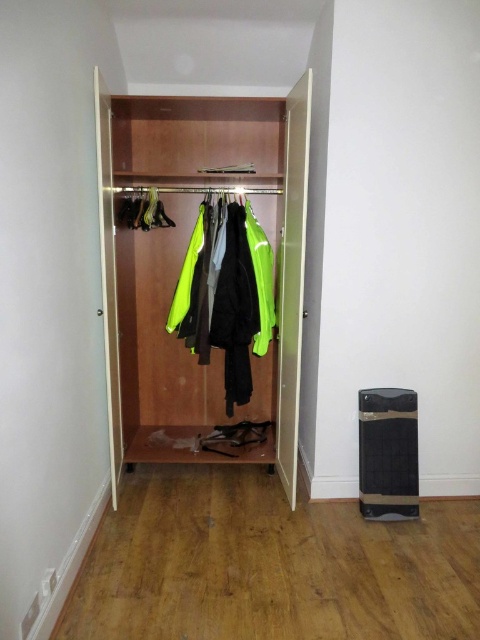
You are organizing your closet and need to place a neon yellow fabric at center. Where should you place it relative to the wooden coat rack at center?

The neon yellow fabric at center should be placed to the right of the wooden coat rack at center since the wooden coat rack at center is to the left of neon yellow fabric at center.

You are organizing your closet and need to hang a new coat. You see the wooden coat rack at center and the neon yellow fabric at center. Which object is closer to you, the observer?

The wooden coat rack at center is closer to you because it is in front of the neon yellow fabric at center.

You are organizing your wardrobe and need to place a new scarf. The wooden coat rack at center and the neon yellow fabric at center are both options. Which one is higher up?

The wooden coat rack at center is located above the neon yellow fabric at center, so it is higher up.